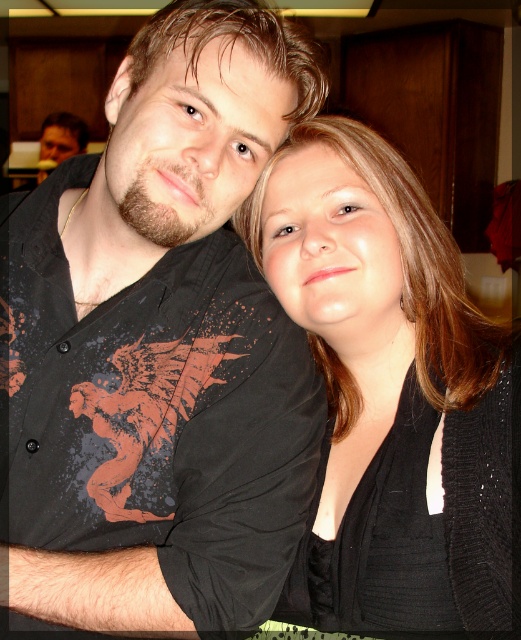
Which of these two, black matte shirt at upper left or black knitwear at center, stands shorter?

With less height is black knitwear at center.

Is black matte shirt at upper left smaller than black knitwear at center?

Actually, black matte shirt at upper left might be larger than black knitwear at center.

Image resolution: width=521 pixels, height=640 pixels. What do you see at coordinates (157, 348) in the screenshot? I see `black matte shirt at upper left` at bounding box center [157, 348].

The height and width of the screenshot is (640, 521). I want to click on black matte shirt at upper left, so click(x=157, y=348).